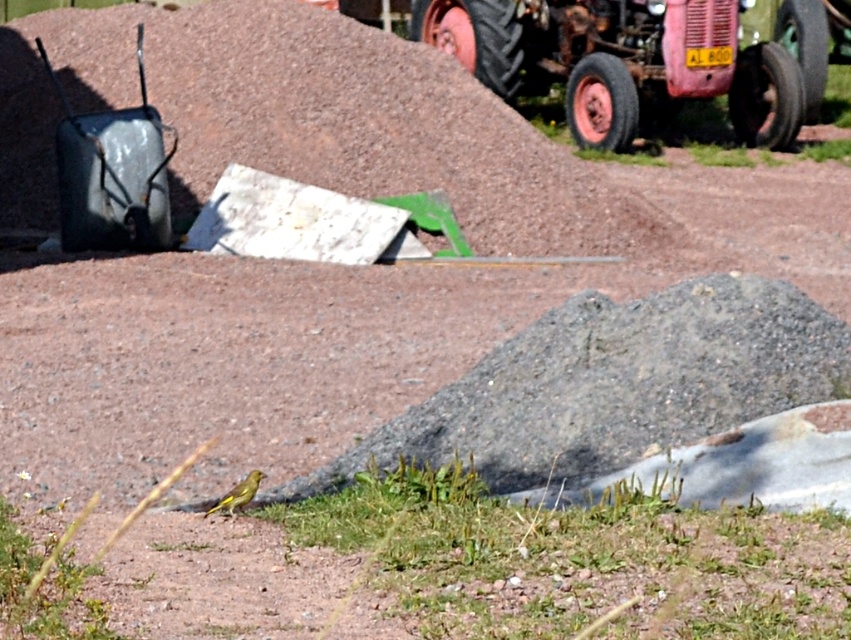
Question: Among these objects, which one is farthest from the camera?

Choices:
 (A) rusty metal tractor at upper center
 (B) brown gravel mound at upper center
 (C) metallic gray wheelbarrow at left

Answer: (A)

Question: Estimate the real-world distances between objects in this image. Which object is closer to the rusty metal tractor at upper center?

Choices:
 (A) metallic gray wheelbarrow at left
 (B) brown gravel mound at upper center

Answer: (B)

Question: Which object is the farthest from the brown gravel mound at upper center?

Choices:
 (A) rusty metal tractor at upper center
 (B) metallic gray wheelbarrow at left

Answer: (A)

Question: Is rusty metal tractor at upper center closer to camera compared to metallic gray wheelbarrow at left?

Choices:
 (A) yes
 (B) no

Answer: (B)

Question: Is brown gravel mound at upper center smaller than metallic gray wheelbarrow at left?

Choices:
 (A) yes
 (B) no

Answer: (B)

Question: Observing the image, what is the correct spatial positioning of brown gravel mound at upper center in reference to rusty metal tractor at upper center?

Choices:
 (A) above
 (B) below

Answer: (B)